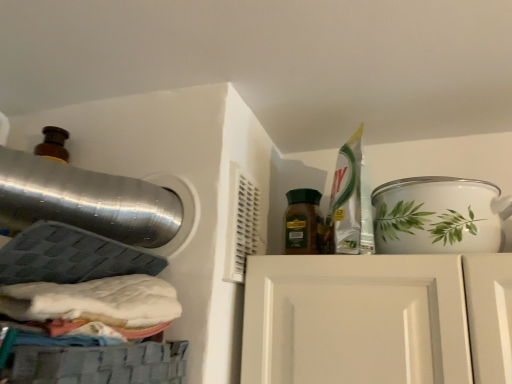
The width and height of the screenshot is (512, 384). I want to click on green matte jar at center, so click(303, 222).

What do you see at coordinates (303, 222) in the screenshot? The image size is (512, 384). I see `green matte jar at center` at bounding box center [303, 222].

Describe the element at coordinates (439, 215) in the screenshot. This screenshot has width=512, height=384. I see `white ceramic pot at upper right` at that location.

Measure the distance between white ceramic pot at upper right and camera.

white ceramic pot at upper right is 31.08 inches away from camera.

What are the coordinates of `white ceramic pot at upper right` in the screenshot? It's located at (439, 215).

Identify the location of green matte jar at center. This screenshot has width=512, height=384. (303, 222).

Can you confirm if white ceramic pot at upper right is positioned to the right of green matte jar at center?

Correct, you'll find white ceramic pot at upper right to the right of green matte jar at center.

Between white ceramic pot at upper right and green matte jar at center, which one is positioned behind?

Positioned behind is green matte jar at center.

Is point (403, 230) in front of point (308, 220)?

Yes, point (403, 230) is in front of point (308, 220).

From the image's perspective, is white ceramic pot at upper right above or below green matte jar at center?

Clearly, from the image's perspective, white ceramic pot at upper right is below green matte jar at center.

From a real-world perspective, which is physically below, white ceramic pot at upper right or green matte jar at center?

In real-world perspective, white ceramic pot at upper right is lower.

Based on the photo, does white ceramic pot at upper right have a greater width compared to green matte jar at center?

Yes.

Does white ceramic pot at upper right have a lesser height compared to green matte jar at center?

Yes, white ceramic pot at upper right is shorter than green matte jar at center.

Considering the sizes of white ceramic pot at upper right and green matte jar at center in the image, is white ceramic pot at upper right bigger or smaller than green matte jar at center?

In the image, white ceramic pot at upper right appears to be larger than green matte jar at center.

Is white ceramic pot at upper right not inside green matte jar at center?

Absolutely, white ceramic pot at upper right is external to green matte jar at center.

Would you say white ceramic pot at upper right is a long distance from green matte jar at center?

No, white ceramic pot at upper right is in close proximity to green matte jar at center.

Is white ceramic pot at upper right facing away from green matte jar at center?

white ceramic pot at upper right is not turned away from green matte jar at center.

How much distance is there between white ceramic pot at upper right and green matte jar at center?

white ceramic pot at upper right is 9.34 inches from green matte jar at center.

Where is `tableware lying in front of the green matte jar at center`? The image size is (512, 384). tableware lying in front of the green matte jar at center is located at coordinates (439, 215).

Which object is positioned more to the right, green matte jar at center or white ceramic pot at upper right?

From the viewer's perspective, white ceramic pot at upper right appears more on the right side.

Which object is closer to the camera, green matte jar at center or white ceramic pot at upper right?

Positioned in front is white ceramic pot at upper right.

Which is in front, point (304, 235) or point (411, 225)?

The point (411, 225) is in front.

From the image's perspective, is green matte jar at center over white ceramic pot at upper right?

Yes.

From a real-world perspective, which object rests below the other?

white ceramic pot at upper right is physically lower.

Looking at their sizes, would you say green matte jar at center is wider or thinner than white ceramic pot at upper right?

Clearly, green matte jar at center has less width compared to white ceramic pot at upper right.

In terms of height, does green matte jar at center look taller or shorter compared to white ceramic pot at upper right?

green matte jar at center is taller than white ceramic pot at upper right.

Considering the sizes of objects green matte jar at center and white ceramic pot at upper right in the image provided, who is smaller, green matte jar at center or white ceramic pot at upper right?

Smaller between the two is green matte jar at center.

Is green matte jar at center situated inside white ceramic pot at upper right or outside?

green matte jar at center is not enclosed by white ceramic pot at upper right.

Is green matte jar at center in contact with white ceramic pot at upper right?

green matte jar at center is not next to white ceramic pot at upper right, and they're not touching.

Is green matte jar at center facing towards white ceramic pot at upper right?

No.

How different are the orientations of green matte jar at center and white ceramic pot at upper right in degrees?

They differ by 0.00066 degrees in their facing directions.

In the scene shown: Measure the distance between green matte jar at center and white ceramic pot at upper right.

green matte jar at center and white ceramic pot at upper right are 9.34 inches apart from each other.

Locate an element on the screen. The image size is (512, 384). tableware below the green matte jar at center (from the image's perspective) is located at coordinates (439, 215).

Locate an element on the screen. The height and width of the screenshot is (384, 512). bottle behind the white ceramic pot at upper right is located at coordinates tap(303, 222).

In order to click on tableware in front of the green matte jar at center in this screenshot , I will do `click(439, 215)`.